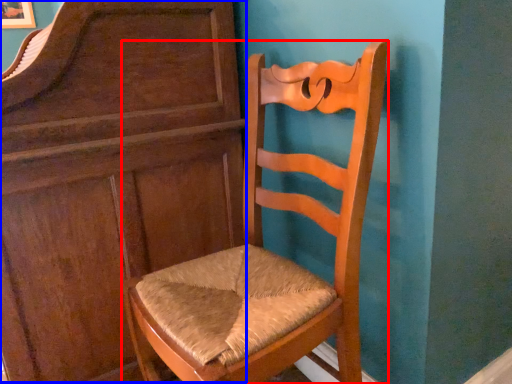
Question: Which point is closer to the camera, chair (highlighted by a red box) or dresser (highlighted by a blue box)?

Choices:
 (A) chair
 (B) dresser

Answer: (A)